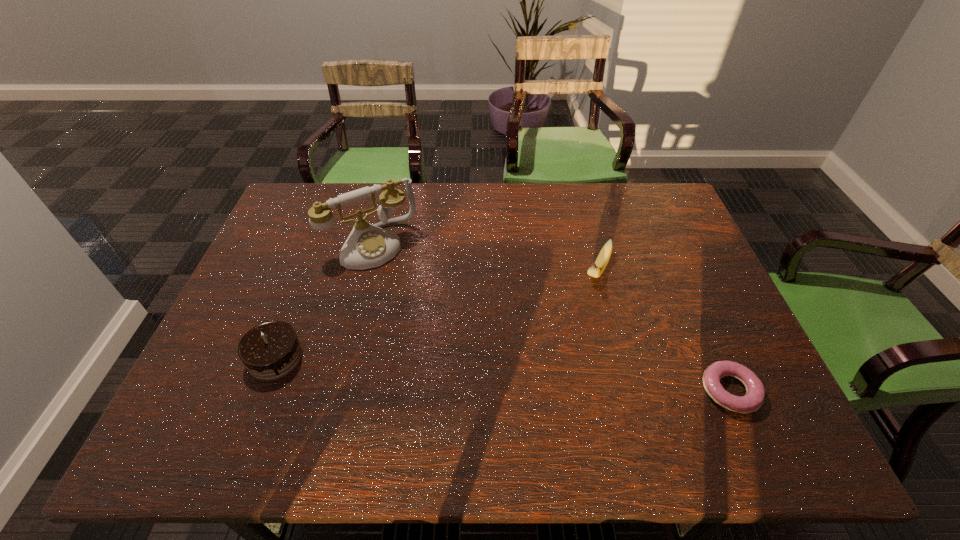
Where is `free space on the desktop that is between the chocolate cake and the rightmost object and is positioned on the dial of the tallest object`? The image size is (960, 540). free space on the desktop that is between the chocolate cake and the rightmost object and is positioned on the dial of the tallest object is located at coordinates (452, 370).

Locate an element on the screen. The height and width of the screenshot is (540, 960). vacant space on the desktop that is between the chocolate cake and the rightmost object and is positioned at the stem of the second object from right to left is located at coordinates (540, 377).